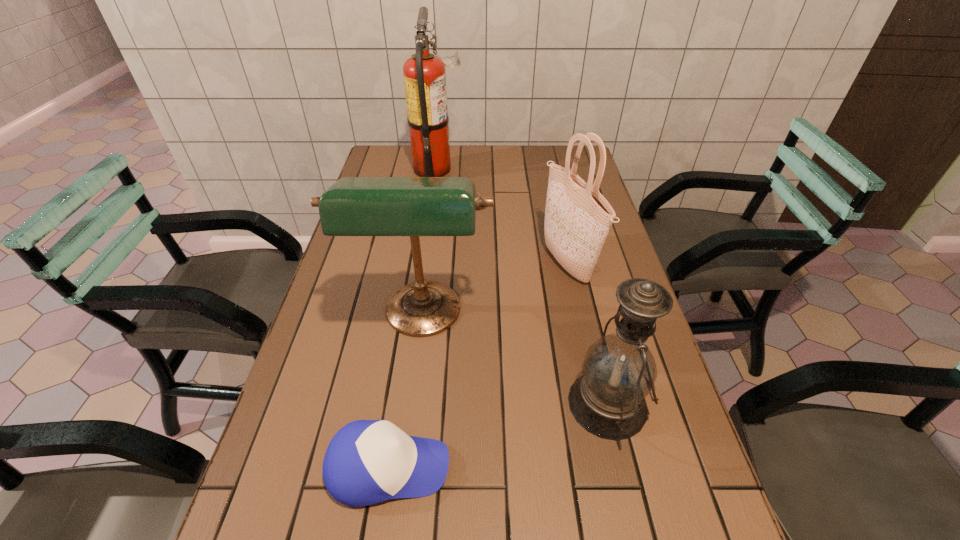
Image resolution: width=960 pixels, height=540 pixels. What are the coordinates of `vacant space located on the front-facing side of the shortest object` in the screenshot? It's located at (652, 468).

Find the location of a particular element. object present at the far edge is located at coordinates (424, 74).

Where is `fire extinguisher at the left edge`? This screenshot has height=540, width=960. fire extinguisher at the left edge is located at coordinates (424, 74).

At what (x,y) coordinates should I click in order to perform the action: click on table lamp at the left edge. Please return your answer as a coordinate pair (x, y). Image resolution: width=960 pixels, height=540 pixels. Looking at the image, I should click on (353, 206).

Locate an element on the screen. baseball cap that is at the left edge is located at coordinates coord(367,461).

You are a GUI agent. You are given a task and a screenshot of the screen. Output one action in this format:
    pyautogui.click(x=<x>, y=<y>)
    Task: Click on the shopping bag that is at the right edge
    The height and width of the screenshot is (540, 960).
    Given the screenshot: What is the action you would take?
    pyautogui.click(x=578, y=218)

I want to click on oil lamp that is at the right edge, so click(x=619, y=370).

At what (x,y) coordinates should I click in order to perform the action: click on object that is at the far left corner. Please return your answer as a coordinate pair (x, y). Image resolution: width=960 pixels, height=540 pixels. Looking at the image, I should click on (424, 74).

In the image, there is a desktop. Identify the location of vacant space at the far edge. This screenshot has height=540, width=960. (479, 161).

Image resolution: width=960 pixels, height=540 pixels. In the image, there is a desktop. Identify the location of blank space at the left edge. (314, 377).